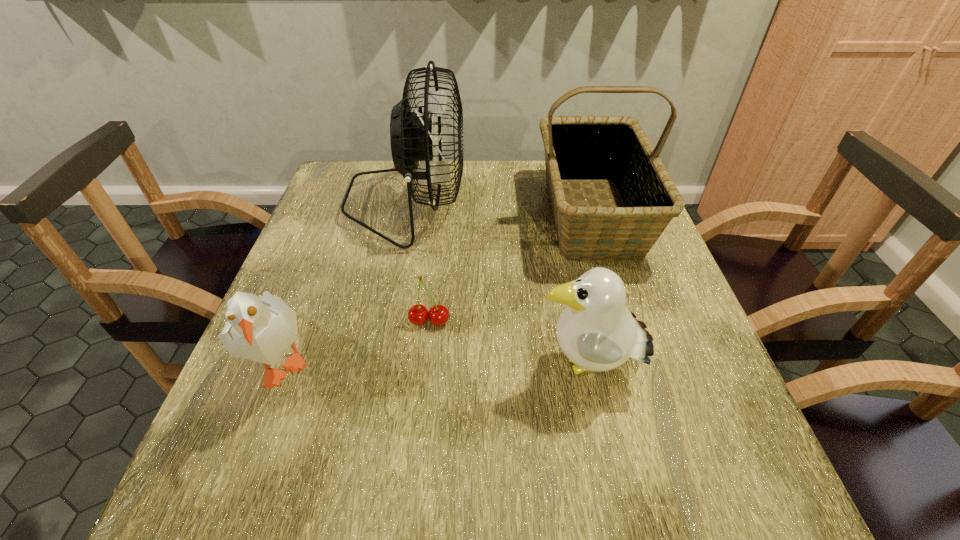
The width and height of the screenshot is (960, 540). In order to click on free space between the right gull and the left gull in this screenshot , I will do `click(436, 363)`.

Locate an element on the screen. The height and width of the screenshot is (540, 960). blank region between the right gull and the fan is located at coordinates (497, 286).

At what (x,y) coordinates should I click in order to perform the action: click on object that is the fourth closest one to the right gull. Please return your answer as a coordinate pair (x, y). Image resolution: width=960 pixels, height=540 pixels. Looking at the image, I should click on pyautogui.click(x=261, y=329).

Locate which object ranks fourth in proximity to the fan. Please provide its 2D coordinates. Your answer should be formatted as a tuple, i.e. [(x, y)], where the tuple contains the x and y coordinates of a point satisfying the conditions above.

[(596, 331)]

What are the coordinates of `free space that satisfies the following two spatial constraints: 1. in front of the fan, directing airflow; 2. at the beak of the left gull` in the screenshot? It's located at (374, 359).

Where is `vacant position in the image that satisfies the following two spatial constraints: 1. in front of the fan, directing airflow; 2. at the beak of the left gull`? vacant position in the image that satisfies the following two spatial constraints: 1. in front of the fan, directing airflow; 2. at the beak of the left gull is located at coordinates (374, 359).

This screenshot has height=540, width=960. What are the coordinates of `vacant region that satisfies the following two spatial constraints: 1. in front of the fan, directing airflow; 2. at the beak of the left gull` in the screenshot? It's located at (374, 359).